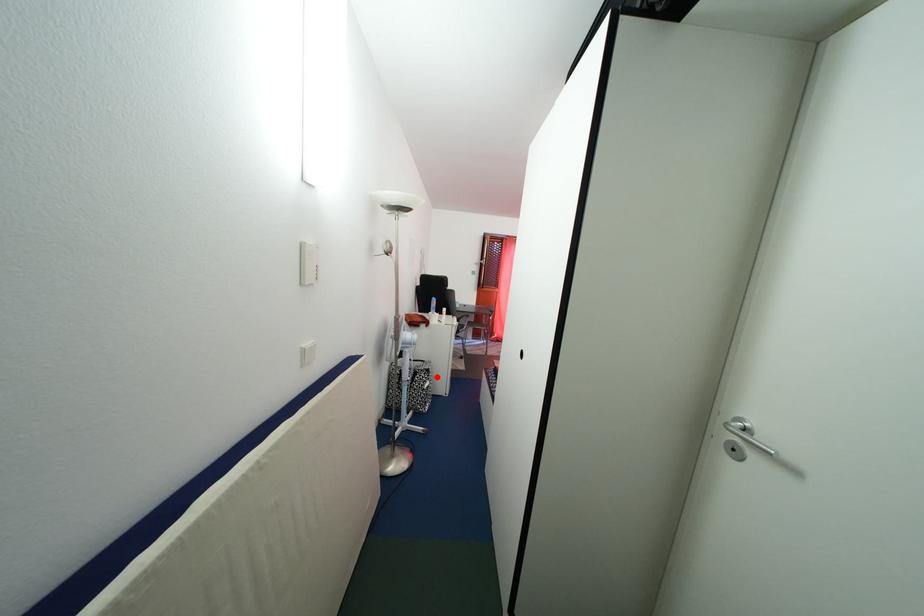
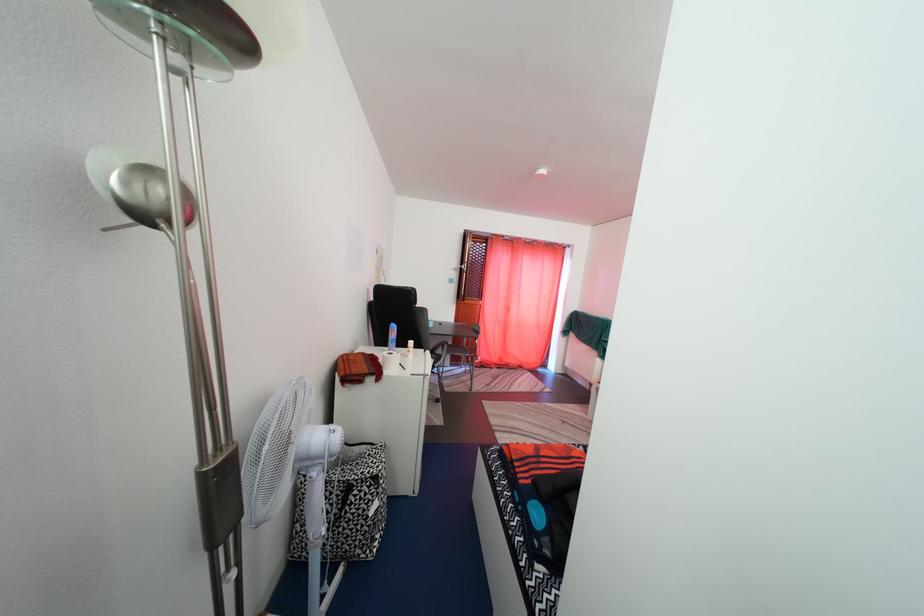
Locate, in the second image, the point that corresponds to the highlighted location in the first image.

(384, 485)